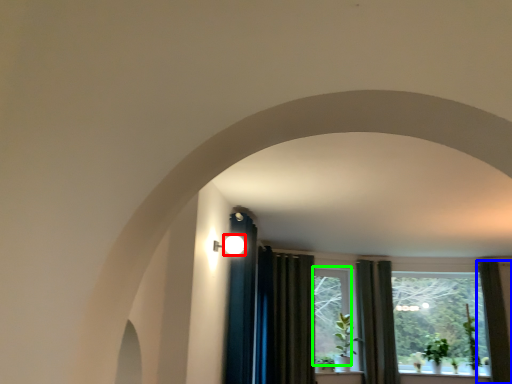
Question: Which is farther away from light (highlighted by a red box)? curtain (highlighted by a blue box) or window (highlighted by a green box)?

Choices:
 (A) curtain
 (B) window

Answer: (A)